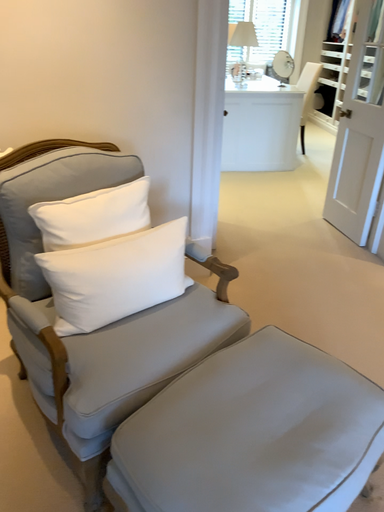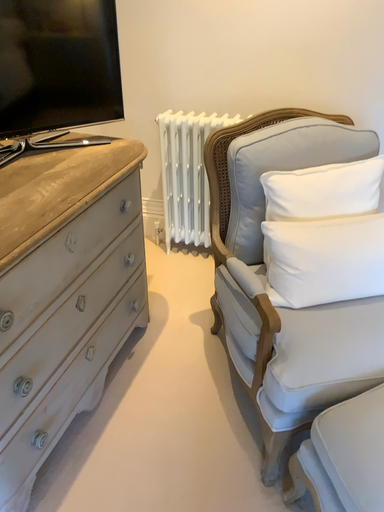
Question: Which way did the camera rotate in the video?

Choices:
 (A) rotated right
 (B) rotated left

Answer: (B)